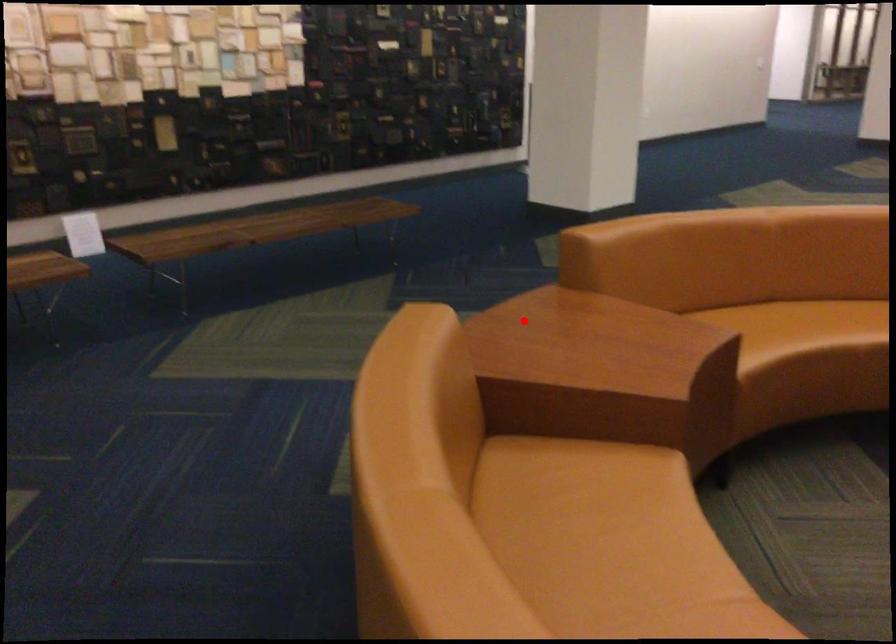
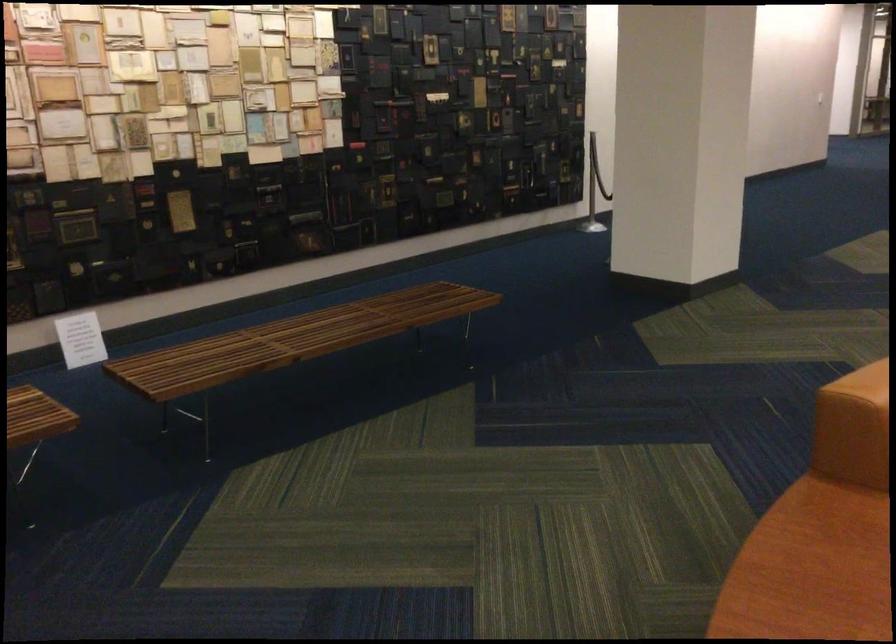
Question: I am providing you with two images of the same scene from different viewpoints. Given a red point in image1, look at the same physical point in image2. Is it:

Choices:
 (A) Closer to the viewpoint
 (B) Farther from the viewpoint

Answer: (A)